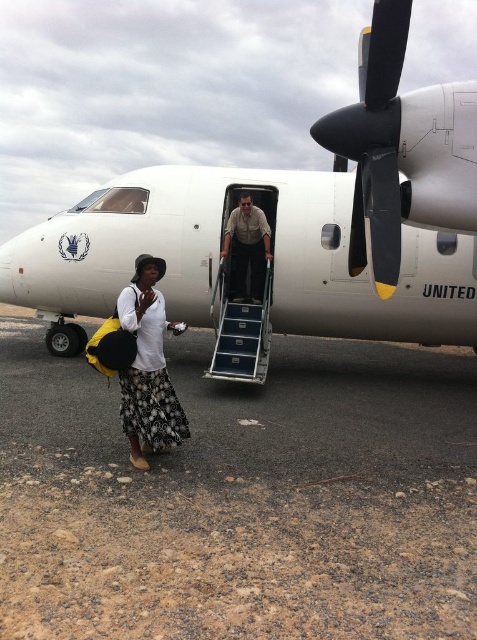
Question: Can you confirm if dirt ground at lower left is positioned above khaki uniform at center?

Choices:
 (A) yes
 (B) no

Answer: (B)

Question: Which point appears farthest from the camera in this image?

Choices:
 (A) (253, 259)
 (B) (256, 577)
 (C) (391, 308)

Answer: (A)

Question: Is dirt ground at lower left thinner than black matte propeller at upper right?

Choices:
 (A) yes
 (B) no

Answer: (A)

Question: Is dirt ground at lower left closer to camera compared to white matte airplane at center?

Choices:
 (A) yes
 (B) no

Answer: (A)

Question: Which point is farther from the camera taking this photo?

Choices:
 (A) (374, 273)
 (B) (375, 28)
 (C) (262, 211)

Answer: (C)

Question: Which object is positioned farthest from the white cotton shirt at lower left?

Choices:
 (A) white matte airplane at center
 (B) khaki uniform at center
 (C) dirt ground at lower left
 (D) black matte propeller at upper right

Answer: (B)